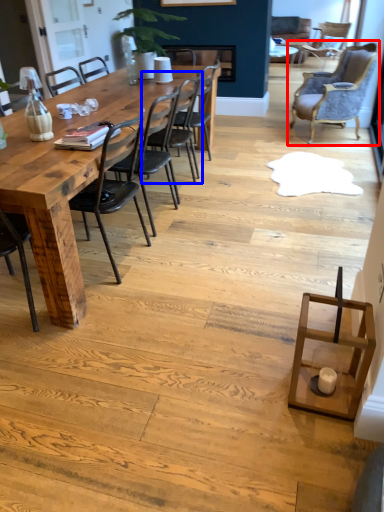
Question: Which object appears farthest to the camera in this image, chair (highlighted by a red box) or chair (highlighted by a blue box)?

Choices:
 (A) chair
 (B) chair

Answer: (A)